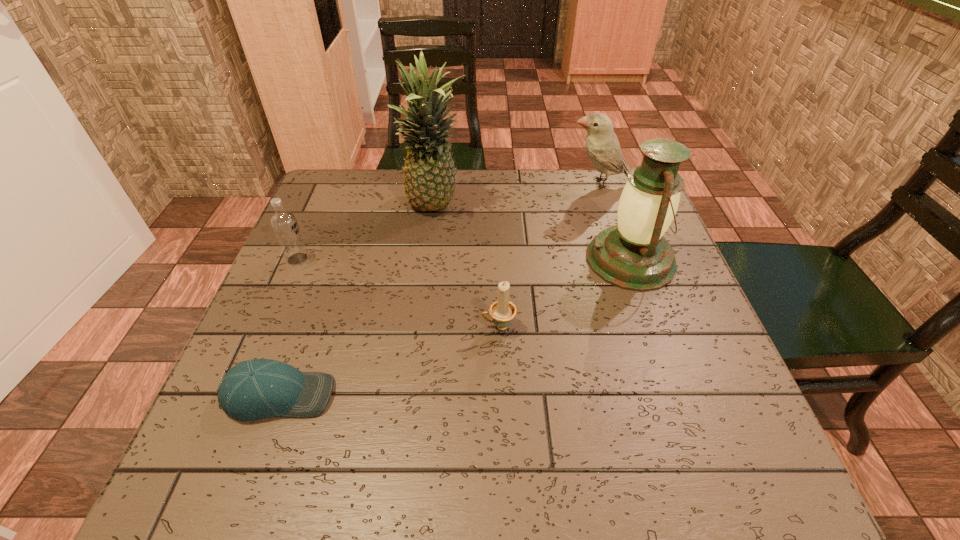
Identify the location of vacant area situated with the light compartment facing forward on the second tallest object. This screenshot has height=540, width=960. (435, 260).

The image size is (960, 540). I want to click on blank space located with the light compartment facing forward on the second tallest object, so click(x=526, y=260).

At what (x,y) coordinates should I click in order to perform the action: click on free space located with the light compartment facing forward on the second tallest object. Please return your answer as a coordinate pair (x, y). Looking at the image, I should click on (500, 260).

Image resolution: width=960 pixels, height=540 pixels. What are the coordinates of `vacant space located 0.140m at the face of the third tallest object` in the screenshot? It's located at (517, 183).

Locate an element on the screen. The width and height of the screenshot is (960, 540). free space located 0.350m at the face of the third tallest object is located at coordinates (443, 183).

I want to click on free space located at the face of the third tallest object, so click(x=478, y=183).

I want to click on free space located on the front label of the third shortest object, so click(460, 259).

Where is `vacant space located on the handle side of the candle_holder`? This screenshot has height=540, width=960. vacant space located on the handle side of the candle_holder is located at coordinates (367, 326).

This screenshot has width=960, height=540. I want to click on vacant space located 0.390m on the handle side of the candle_holder, so click(x=286, y=326).

I want to click on vacant point located on the handle side of the candle_holder, so click(x=437, y=326).